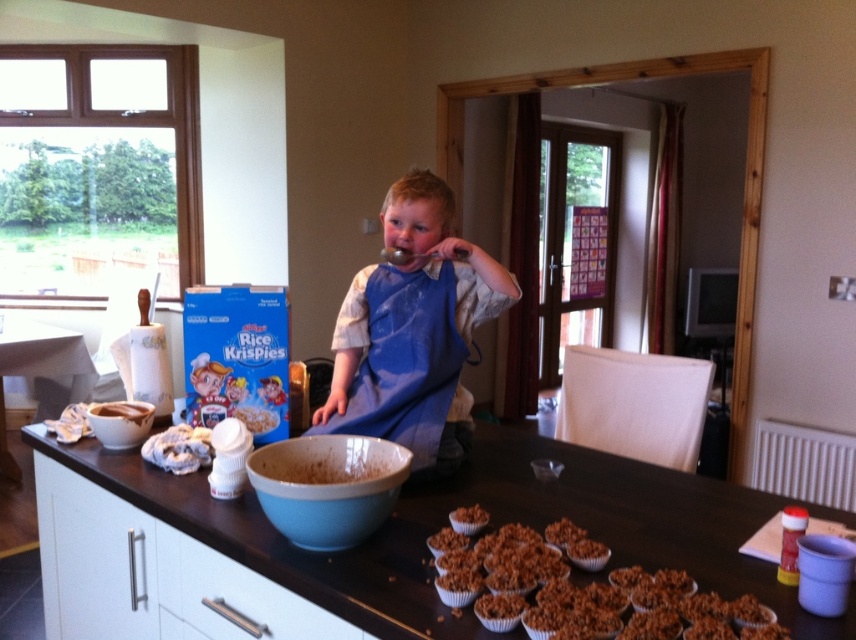
The image size is (856, 640). Find the location of `blue ceramic bowl at center`. blue ceramic bowl at center is located at coordinates (327, 486).

Identify the location of blue ceramic bowl at center. The width and height of the screenshot is (856, 640). (327, 486).

You are a GUI agent. You are given a task and a screenshot of the screen. Output one action in this format:
    pyautogui.click(x=<x>, y=<y>)
    Task: Click on the blue ceramic bowl at center
    The image size is (856, 640).
    Given the screenshot: What is the action you would take?
    pyautogui.click(x=327, y=486)

Can you confirm if blue ceramic bowl at center is shorter than crispy brown cereal at center?

In fact, blue ceramic bowl at center may be taller than crispy brown cereal at center.

Between point (324, 515) and point (465, 512), which one is positioned behind?

The point (465, 512) is more distant.

The height and width of the screenshot is (640, 856). Describe the element at coordinates (327, 486) in the screenshot. I see `blue ceramic bowl at center` at that location.

In order to click on blue ceramic bowl at center in this screenshot , I will do `click(327, 486)`.

Does crispy brown muffin at lower center lie behind crispy brown cereal at center?

No.

This screenshot has height=640, width=856. What do you see at coordinates (581, 589) in the screenshot?
I see `crispy brown muffin at lower center` at bounding box center [581, 589].

Identify the location of crispy brown muffin at lower center. Image resolution: width=856 pixels, height=640 pixels. (581, 589).